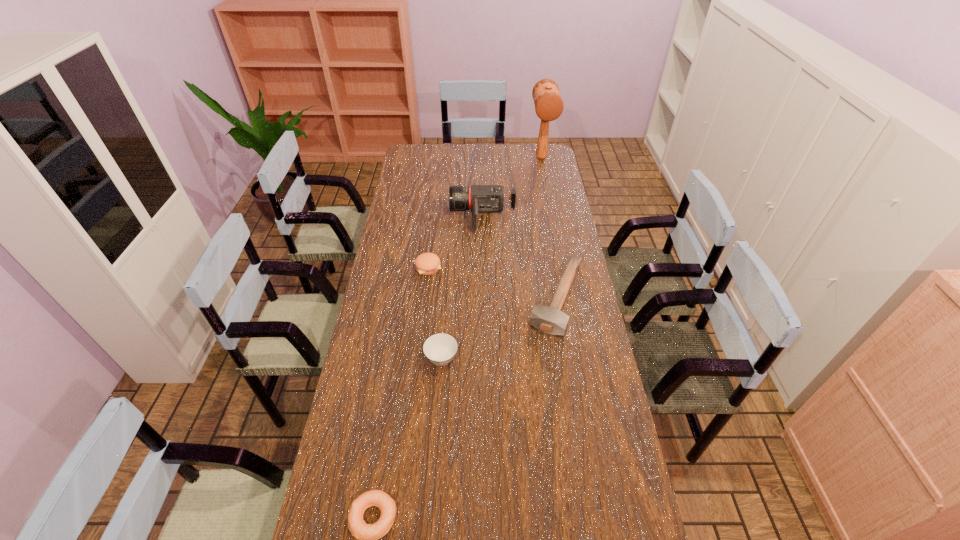
Where is `free region that satisfies the following two spatial constraints: 1. on the lens of the nearer mallet; 2. on the left side of the camcorder`? The image size is (960, 540). free region that satisfies the following two spatial constraints: 1. on the lens of the nearer mallet; 2. on the left side of the camcorder is located at coordinates (484, 298).

I want to click on free space that satisfies the following two spatial constraints: 1. on the back side of the shorter mallet; 2. on the lens of the second tallest object, so pos(543,215).